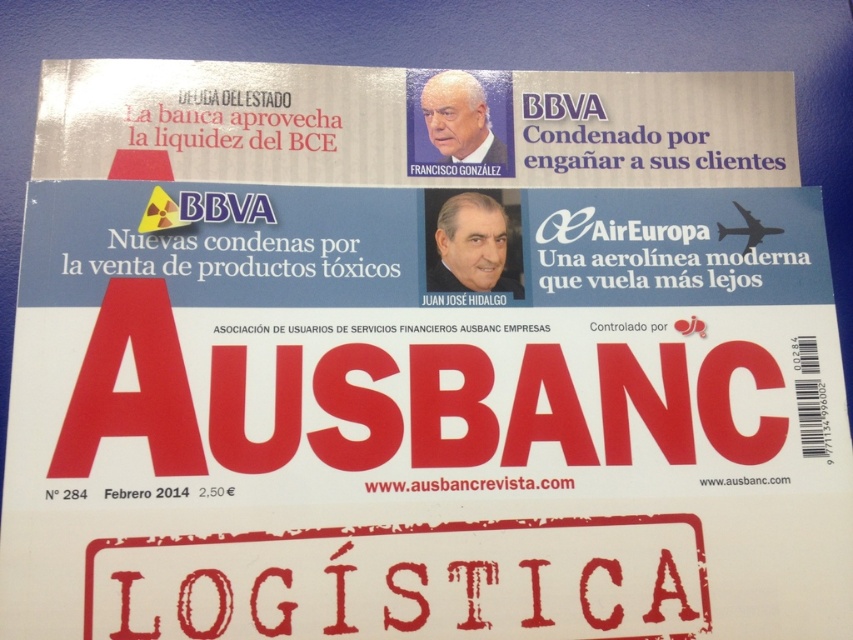
From the picture: Is smooth skin portrait at center positioned in front of white matte portrait at upper center?

That is True.

Who is higher up, smooth skin portrait at center or white matte portrait at upper center?

white matte portrait at upper center

Is point (485, 266) closer to viewer compared to point (450, 99)?

That is True.

Identify the location of smooth skin portrait at center. (471, 246).